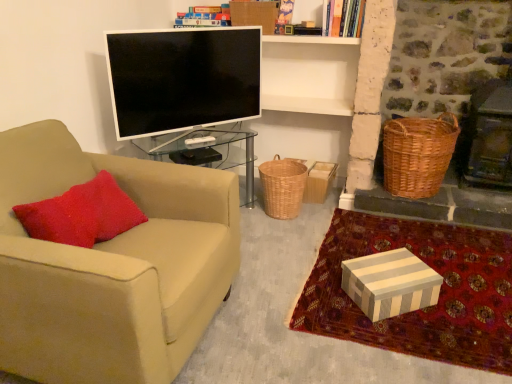
Find the location of a particular element. The height and width of the screenshot is (384, 512). free space in front of striped cardboard box at lower right is located at coordinates (415, 333).